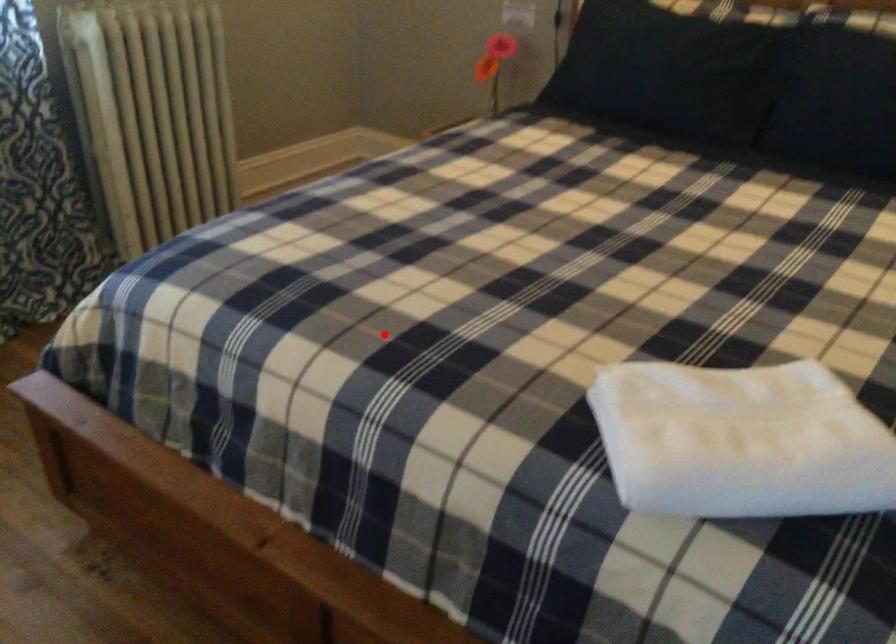
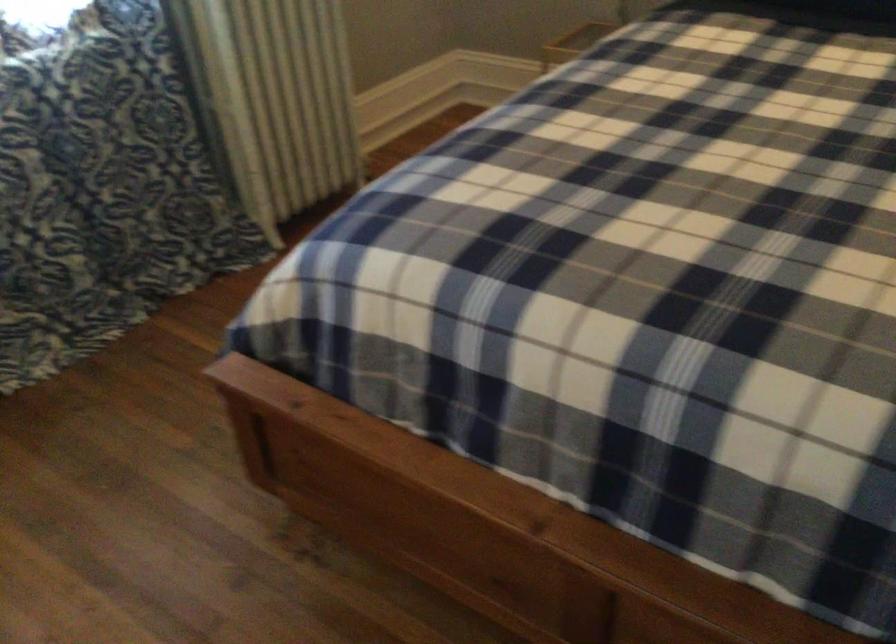
Question: I am providing you with two images of the same scene from different viewpoints. Image1 has a red point marked. In image2, the corresponding 3D location appears at what relative position? Reply with the corresponding letter.

Choices:
 (A) Closer
 (B) Farther

Answer: (A)